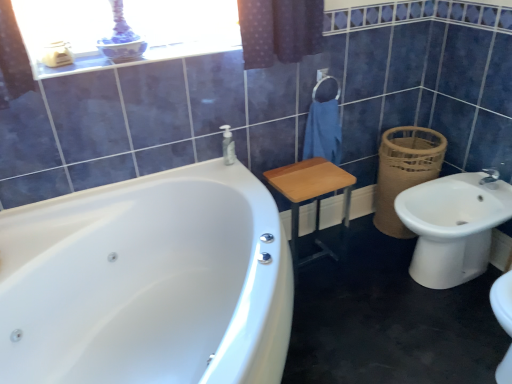
What do you see at coordinates (453, 225) in the screenshot? The height and width of the screenshot is (384, 512). I see `white glossy sink at lower right` at bounding box center [453, 225].

Measure the distance between point (346, 237) and camera.

The distance of point (346, 237) from camera is 7.48 feet.

Image resolution: width=512 pixels, height=384 pixels. I want to click on clear plastic soap dispenser at upper center, so click(228, 146).

Can you confirm if white glossy bathtub at left is smaller than blue cotton towel at center?

Actually, white glossy bathtub at left might be larger than blue cotton towel at center.

Is white glossy bathtub at left situated inside blue cotton towel at center or outside?

white glossy bathtub at left lies outside blue cotton towel at center.

Which of these two, white glossy bathtub at left or blue cotton towel at center, stands shorter?

blue cotton towel at center is shorter.

From the image's perspective, does white glossy bathtub at left appear lower than blue cotton towel at center?

Yes, from the image's perspective, white glossy bathtub at left is beneath blue cotton towel at center.

Does white glossy sink at lower right have a smaller size compared to clear plastic soap dispenser at upper center?

No.

Which of these two, white glossy sink at lower right or clear plastic soap dispenser at upper center, is wider?

white glossy sink at lower right.

Which object is more forward, white glossy sink at lower right or clear plastic soap dispenser at upper center?

Positioned in front is white glossy sink at lower right.

Which is in front, point (452, 262) or point (225, 145)?

Point (225, 145)

Identify the location of balustrade above the wooden stool at center (from the image's perspective). The width and height of the screenshot is (512, 384). (140, 59).

From a real-world perspective, which object stands above the other?

From a 3D spatial view, white glossy balustrade at upper center is above.

From the image's perspective, is wooden stool at center located beneath white glossy balustrade at upper center?

Yes, from the image's perspective, wooden stool at center is beneath white glossy balustrade at upper center.

Between wooden stool at center and white glossy balustrade at upper center, which one appears on the right side from the viewer's perspective?

Positioned to the right is wooden stool at center.

Considering the positions of objects white glossy sink at lower right and white glossy bathtub at left in the image provided, who is more to the left, white glossy sink at lower right or white glossy bathtub at left?

Positioned to the left is white glossy bathtub at left.

Could you tell me if white glossy sink at lower right is facing white glossy bathtub at left?

Yes.

At what (x,y) coordinates should I click in order to perform the action: click on bathtub that appears on the left of white glossy sink at lower right. Please return your answer as a coordinate pair (x, y). Image resolution: width=512 pixels, height=384 pixels. Looking at the image, I should click on (147, 282).

Is white glossy balustrade at upper center oriented towards white glossy bathtub at left?

No, white glossy balustrade at upper center does not turn towards white glossy bathtub at left.

Between white glossy balustrade at upper center and white glossy bathtub at left, which one appears on the right side from the viewer's perspective?

white glossy bathtub at left.

Is white glossy balustrade at upper center smaller than white glossy bathtub at left?

Indeed, white glossy balustrade at upper center has a smaller size compared to white glossy bathtub at left.

At what (x,y) coordinates should I click in order to perform the action: click on balustrade on the left of the white glossy bathtub at left. Please return your answer as a coordinate pair (x, y). This screenshot has height=384, width=512. Looking at the image, I should click on (140, 59).

Is wooden stool at center to the right of brown woven basket at right from the viewer's perspective?

No, wooden stool at center is not to the right of brown woven basket at right.

Which object is wider, wooden stool at center or brown woven basket at right?

With larger width is brown woven basket at right.

Can you tell me how much wooden stool at center and brown woven basket at right differ in facing direction?

93.3 degrees.

How distant is wooden stool at center from brown woven basket at right?

wooden stool at center and brown woven basket at right are 39.69 centimeters apart.

Is wooden stool at center inside the boundaries of blue cotton towel at center, or outside?

wooden stool at center cannot be found inside blue cotton towel at center.

From the image's perspective, is wooden stool at center under blue cotton towel at center?

Yes, from the image's perspective, wooden stool at center is below blue cotton towel at center.

Where is `bath towel above the white glossy bathtub at left (from a real-world perspective)`? The image size is (512, 384). bath towel above the white glossy bathtub at left (from a real-world perspective) is located at coordinates (323, 132).

The image size is (512, 384). I want to click on toiletry located behind the white glossy sink at lower right, so click(x=228, y=146).

Based on their spatial positions, is brown woven basket at right or white glossy sink at lower right further from blue cotton towel at center?

white glossy sink at lower right lies further to blue cotton towel at center than the other object.

Looking at this image, based on their spatial positions, is brown woven basket at right or white glossy sink at lower right further from wooden stool at center?

white glossy sink at lower right is further to wooden stool at center.

Based on their spatial positions, is white glossy balustrade at upper center or white glossy bathtub at left closer to clear plastic soap dispenser at upper center?

Among the two, white glossy balustrade at upper center is located nearer to clear plastic soap dispenser at upper center.

Looking at the image, which one is located further to white glossy balustrade at upper center, white glossy bathtub at left or wooden stool at center?

wooden stool at center lies further to white glossy balustrade at upper center than the other object.

Which object lies further to the anchor point white glossy bathtub at left, wooden stool at center or white glossy balustrade at upper center?

white glossy balustrade at upper center is further to white glossy bathtub at left.

Looking at the image, which one is located closer to white glossy balustrade at upper center, white glossy sink at lower right or clear plastic soap dispenser at upper center?

clear plastic soap dispenser at upper center lies closer to white glossy balustrade at upper center than the other object.

Based on the photo, estimate the real-world distances between objects in this image. Which object is closer to clear plastic soap dispenser at upper center, blue cotton towel at center or wooden stool at center?

Among the two, wooden stool at center is located nearer to clear plastic soap dispenser at upper center.

From the picture: Looking at the image, which one is located closer to white glossy balustrade at upper center, blue cotton towel at center or white glossy sink at lower right?

Among the two, blue cotton towel at center is located nearer to white glossy balustrade at upper center.

Image resolution: width=512 pixels, height=384 pixels. In order to click on sink positioned between white glossy bathtub at left and brown woven basket at right from near to far in this screenshot , I will do `click(453, 225)`.

Locate an element on the screen. This screenshot has height=384, width=512. basket between clear plastic soap dispenser at upper center and white glossy sink at lower right from left to right is located at coordinates (404, 171).

This screenshot has width=512, height=384. I want to click on balustrade positioned between white glossy bathtub at left and clear plastic soap dispenser at upper center from near to far, so click(x=140, y=59).

Locate an element on the screen. This screenshot has height=384, width=512. bath towel between wooden stool at center and white glossy sink at lower right is located at coordinates (323, 132).